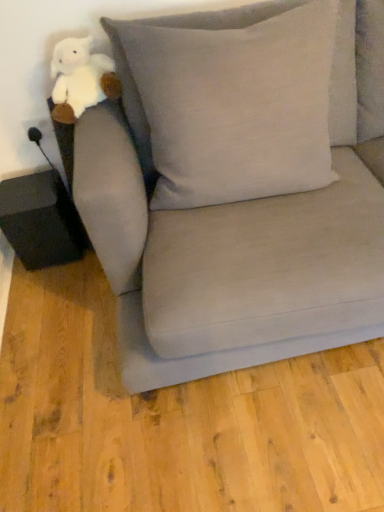
Question: Looking at the image, does matte gray couch at center seem bigger or smaller compared to light gray linen pillow at upper center?

Choices:
 (A) big
 (B) small

Answer: (A)

Question: Choose the correct answer: Is matte gray couch at center inside light gray linen pillow at upper center or outside it?

Choices:
 (A) outside
 (B) inside

Answer: (A)

Question: Estimate the real-world distances between objects in this image. Which object is farther from the matte gray couch at center?

Choices:
 (A) light gray linen pillow at upper center
 (B) white plush toy at upper left

Answer: (B)

Question: Which object is positioned farthest from the light gray linen pillow at upper center?

Choices:
 (A) matte gray couch at center
 (B) white plush toy at upper left

Answer: (B)